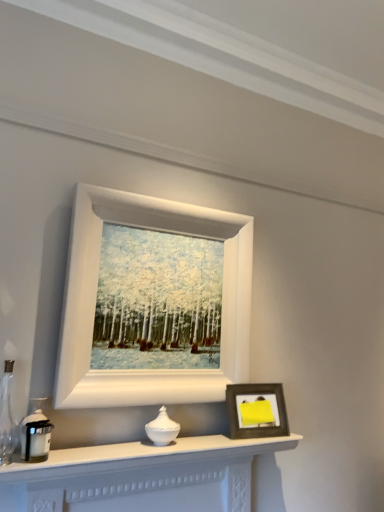
Locate an element on the screen. This screenshot has width=384, height=512. vacant area that is in front of white glossy vase at center, which is counted as the second candle holder, starting from the left is located at coordinates (147, 449).